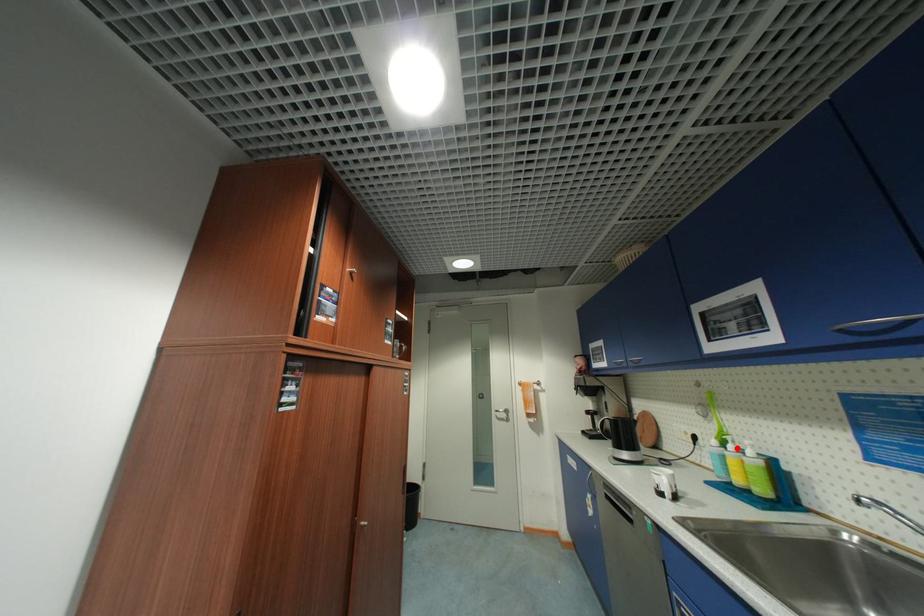
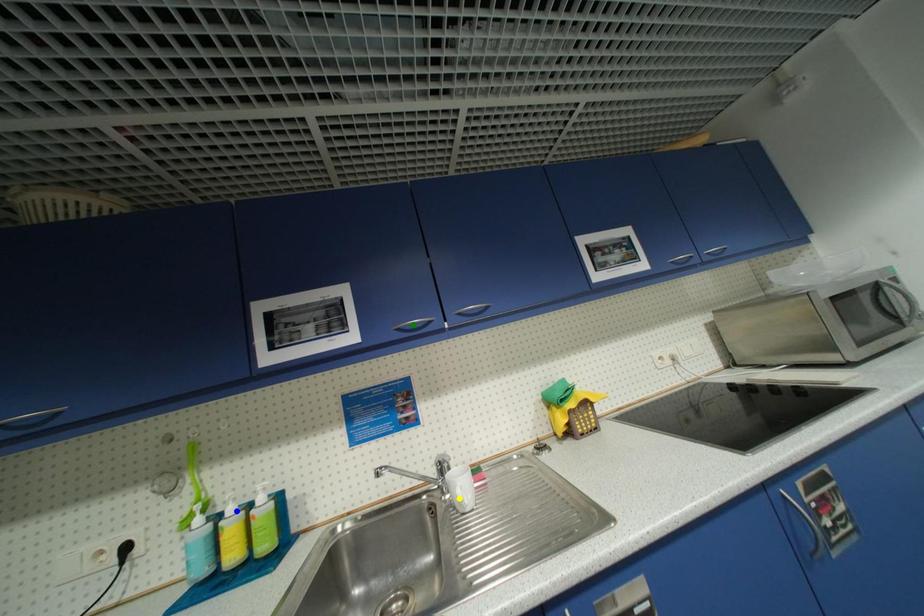
Question: I am providing you with two images of the same scene from different viewpoints. A red point is marked on the first image. You are given multiple points on the second image. In image 2, which mark is for the same physical point as the one in image 1?

Choices:
 (A) green point
 (B) yellow point
 (C) blue point

Answer: (C)